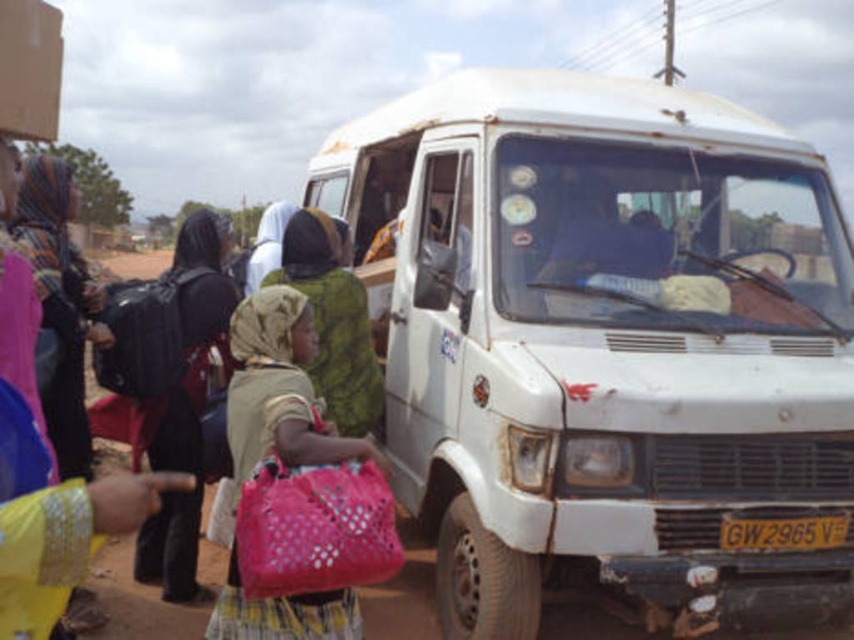
Locate an element on the screen. The width and height of the screenshot is (854, 640). pink fabric bag at center is located at coordinates (278, 460).

Is pink fabric bag at center positioned behind cardboard box at upper left?

Yes, pink fabric bag at center is behind cardboard box at upper left.

Is point (300, 296) closer to camera compared to point (28, 36)?

No.

The width and height of the screenshot is (854, 640). Find the location of `pink fabric bag at center`. pink fabric bag at center is located at coordinates (278, 460).

This screenshot has width=854, height=640. Identify the location of white matte van at center. click(x=607, y=342).

Which of these two, white matte van at center or green fabric headscarf at center, stands taller?

white matte van at center

Locate an element on the screen. Image resolution: width=854 pixels, height=640 pixels. white matte van at center is located at coordinates (607, 342).

Who is taller, black fabric backpack at left or multicolored woven scarf at upper left?

With more height is black fabric backpack at left.

In the scene shown: Is black fabric backpack at left smaller than multicolored woven scarf at upper left?

Actually, black fabric backpack at left might be larger than multicolored woven scarf at upper left.

This screenshot has height=640, width=854. I want to click on black fabric backpack at left, so click(168, 387).